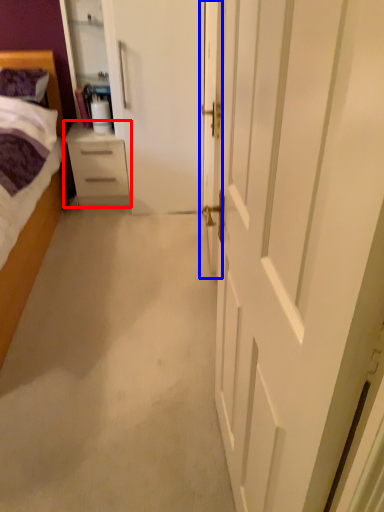
Question: Among these objects, which one is nearest to the camera, chest of drawers (highlighted by a red box) or door (highlighted by a blue box)?

Choices:
 (A) chest of drawers
 (B) door

Answer: (B)